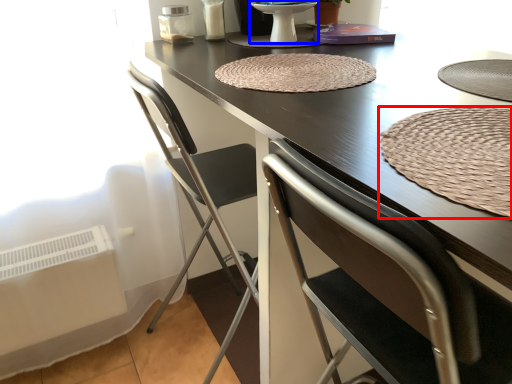
Question: Which of the following is the farthest to the observer, mat (highlighted by a red box) or round table (highlighted by a blue box)?

Choices:
 (A) mat
 (B) round table

Answer: (B)